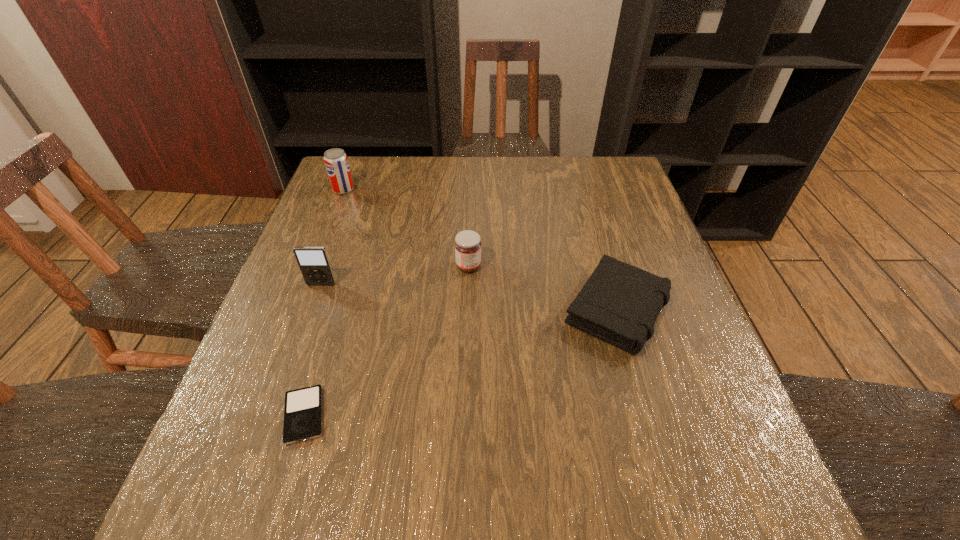
Locate an element on the screen. free space between the shorter iPod and the farther iPod is located at coordinates (313, 350).

At what (x,y) coordinates should I click in order to perform the action: click on vacant space that is in between the nearest object and the farthest object. Please return your answer as a coordinate pair (x, y). The image size is (960, 540). Looking at the image, I should click on click(324, 302).

Locate an element on the screen. The image size is (960, 540). free space that is in between the farther iPod and the fourth object from left to right is located at coordinates (395, 275).

Locate an element on the screen. The width and height of the screenshot is (960, 540). the third closest object to the jam is located at coordinates (303, 407).

Locate an element on the screen. object that is the closest to the shorter iPod is located at coordinates (313, 261).

At what (x,y) coordinates should I click in order to perform the action: click on free location that satisfies the following two spatial constraints: 1. on the front-facing side of the rightmost object; 2. on the right side of the taller iPod. Please return your answer as a coordinate pair (x, y). Looking at the image, I should click on (313, 310).

Image resolution: width=960 pixels, height=540 pixels. In order to click on free location that satisfies the following two spatial constraints: 1. on the front-facing side of the shorter iPod; 2. on the right side of the taller iPod in this screenshot , I will do `click(276, 415)`.